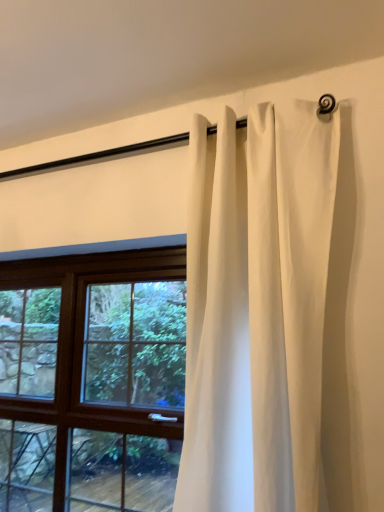
Question: Considering the relative sizes of white cotton curtain at upper center and brown wooden window at center in the image provided, is white cotton curtain at upper center wider than brown wooden window at center?

Choices:
 (A) no
 (B) yes

Answer: (B)

Question: Can you confirm if white cotton curtain at upper center is shorter than brown wooden window at center?

Choices:
 (A) no
 (B) yes

Answer: (A)

Question: Are white cotton curtain at upper center and brown wooden window at center beside each other?

Choices:
 (A) no
 (B) yes

Answer: (A)

Question: Is white cotton curtain at upper center behind brown wooden window at center?

Choices:
 (A) yes
 (B) no

Answer: (B)

Question: Is white cotton curtain at upper center to the right of brown wooden window at center from the viewer's perspective?

Choices:
 (A) no
 (B) yes

Answer: (B)

Question: Does white cotton curtain at upper center appear on the left side of brown wooden window at center?

Choices:
 (A) no
 (B) yes

Answer: (A)

Question: Considering the relative sizes of brown wooden window at center and white cotton curtain at upper center in the image provided, is brown wooden window at center wider than white cotton curtain at upper center?

Choices:
 (A) no
 (B) yes

Answer: (A)

Question: Is white cotton curtain at upper center completely or partially inside brown wooden window at center?

Choices:
 (A) no
 (B) yes

Answer: (A)

Question: Does brown wooden window at center appear on the left side of white cotton curtain at upper center?

Choices:
 (A) no
 (B) yes

Answer: (B)

Question: From a real-world perspective, does brown wooden window at center sit lower than white cotton curtain at upper center?

Choices:
 (A) no
 (B) yes

Answer: (B)

Question: Is brown wooden window at center turned away from white cotton curtain at upper center?

Choices:
 (A) no
 (B) yes

Answer: (A)

Question: From the image's perspective, is brown wooden window at center located beneath white cotton curtain at upper center?

Choices:
 (A) yes
 (B) no

Answer: (A)

Question: In terms of height, does white cotton curtain at upper center look taller or shorter compared to brown wooden window at center?

Choices:
 (A) tall
 (B) short

Answer: (A)